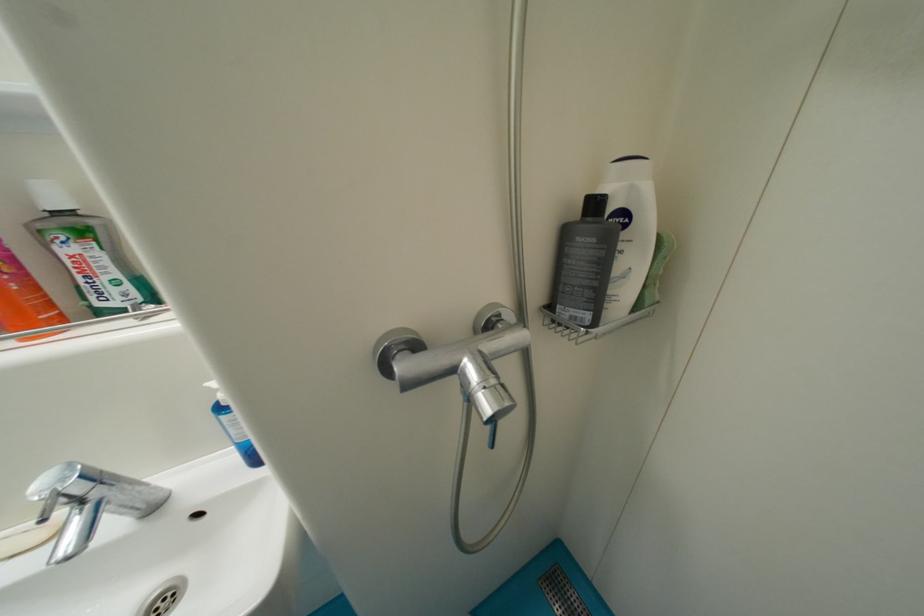
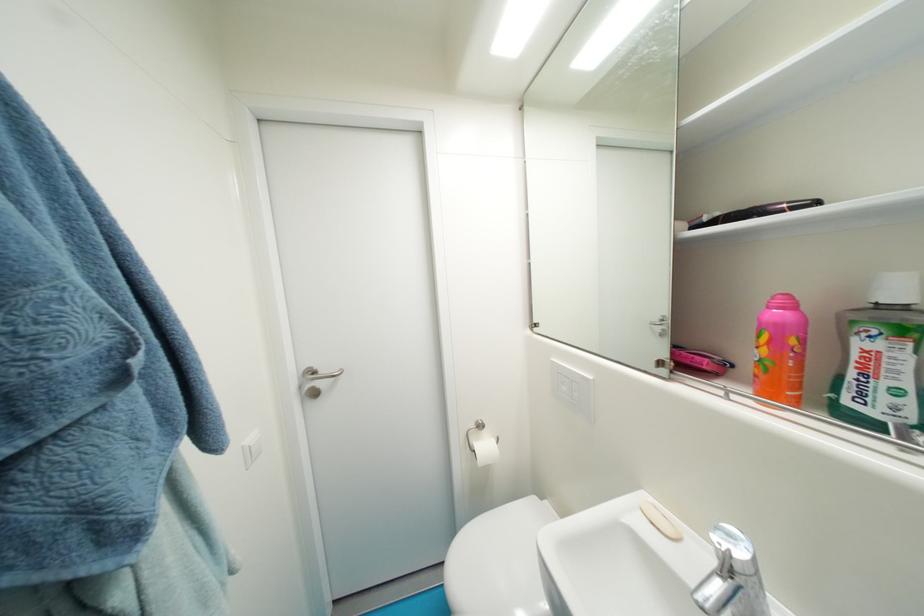
Question: The images are taken continuously from a first-person perspective. In which direction is your viewpoint rotating?

Choices:
 (A) Left
 (B) Right
 (C) Up
 (D) Down

Answer: (A)